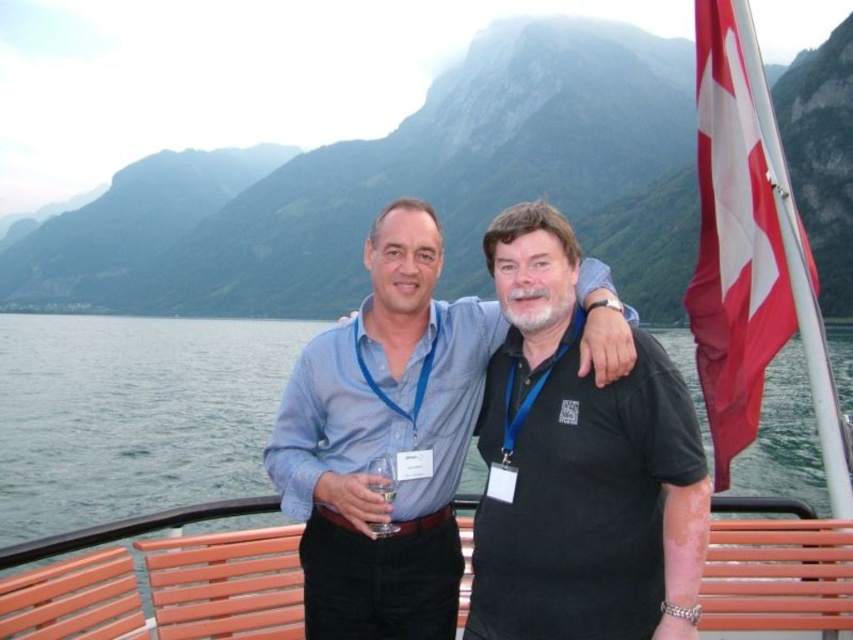
Between black matte shirt at center and transparent water at bench left, which one appears on the right side from the viewer's perspective?

Positioned to the right is black matte shirt at center.

Does black matte shirt at center have a lesser height compared to transparent water at bench left?

Indeed, black matte shirt at center has a lesser height compared to transparent water at bench left.

Who is more distant from viewer, (647, 506) or (51, 404)?

Positioned behind is point (51, 404).

Image resolution: width=853 pixels, height=640 pixels. What are the coordinates of `black matte shirt at center` in the screenshot? It's located at (579, 467).

Is point (509, 26) in front of point (369, 545)?

That is False.

Between point (265, 209) and point (448, 324), which one is positioned behind?

The point (265, 209) is behind.

What are the coordinates of `matte black water at center` in the screenshot? It's located at (402, 189).

Can you confirm if blue cotton shirt at center is wider than red fabric flag at right?

Incorrect, blue cotton shirt at center's width does not surpass red fabric flag at right's.

Where is `blue cotton shirt at center`? blue cotton shirt at center is located at coordinates click(384, 442).

You are a GUI agent. You are given a task and a screenshot of the screen. Output one action in this format:
    pyautogui.click(x=<x>, y=<y>)
    Task: Click on the blue cotton shirt at center
    The height and width of the screenshot is (640, 853).
    Given the screenshot: What is the action you would take?
    pyautogui.click(x=384, y=442)